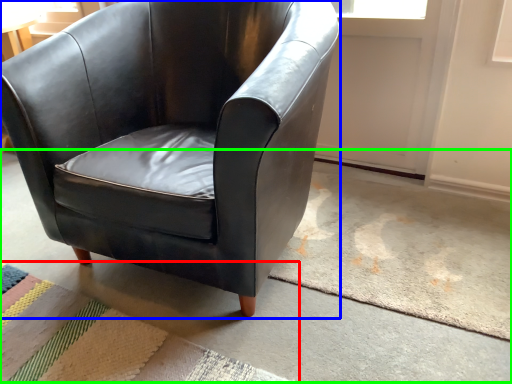
Question: Which object is positioned closest to mat (highlighted by a red box)? Select from chair (highlighted by a blue box) and concrete (highlighted by a green box).

Choices:
 (A) chair
 (B) concrete

Answer: (B)